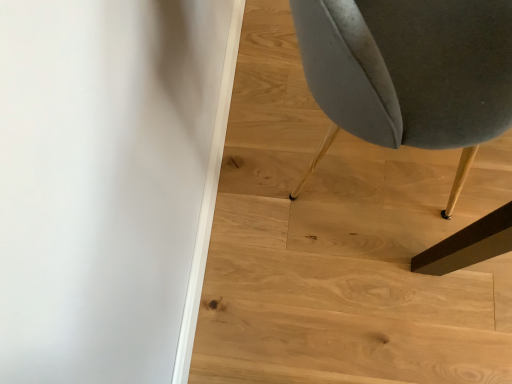
Where is `free space below velvet grey chair at right (from a real-world perspective)`? free space below velvet grey chair at right (from a real-world perspective) is located at coordinates (352, 158).